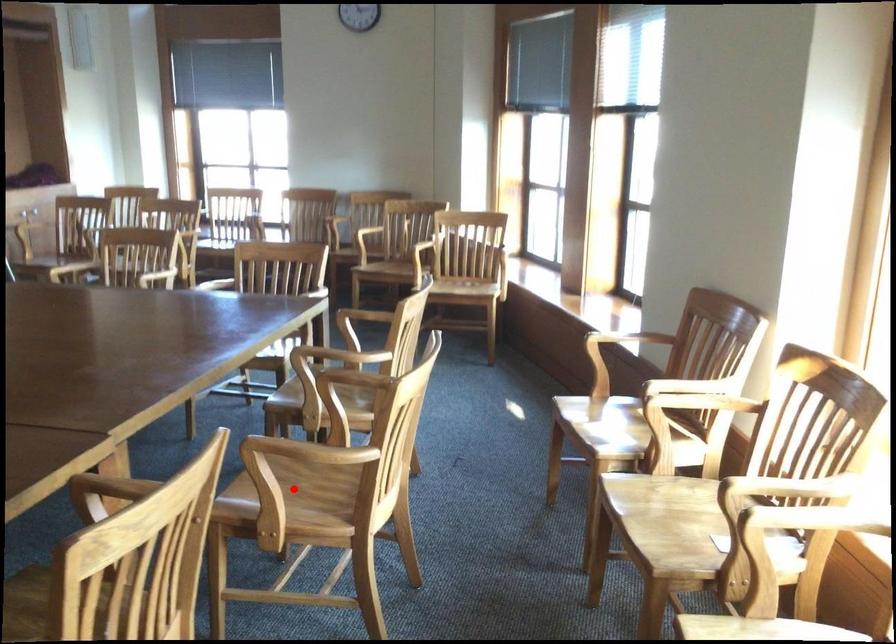
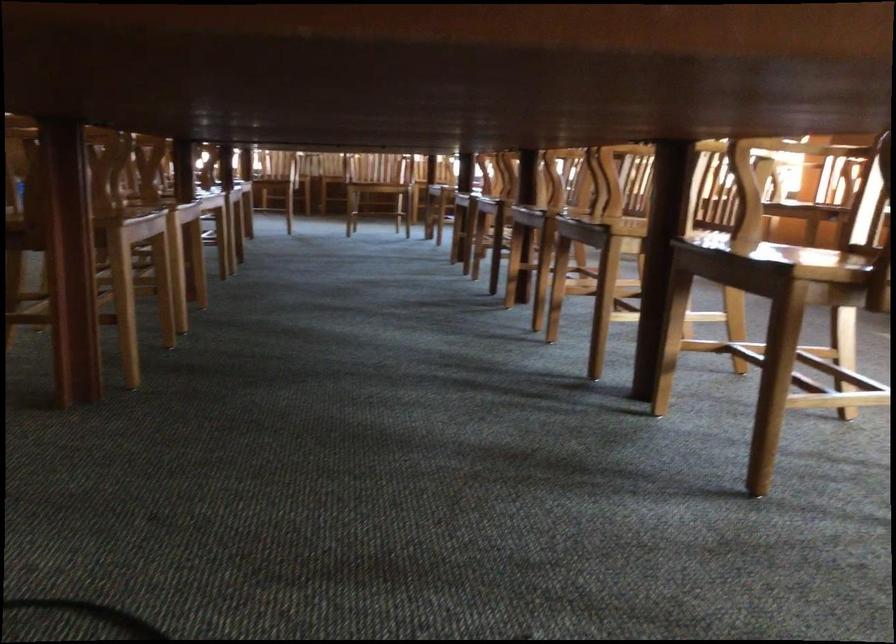
Question: I am providing you with two images of the same scene from different viewpoints. A red point is marked on the first image. At the location where the point appears in image 1, is it still visible in image 2?

Choices:
 (A) Yes
 (B) No

Answer: (B)